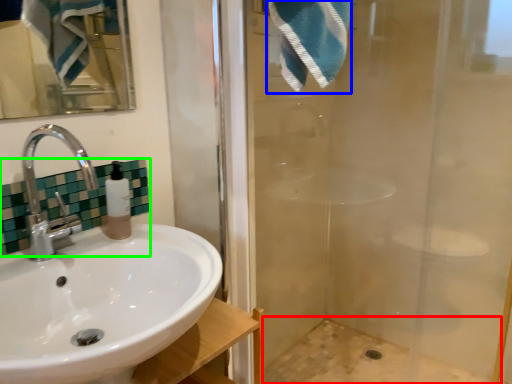
Question: Which is farther away from bath (highlighted by a red box)? bath towel (highlighted by a blue box) or tile (highlighted by a green box)?

Choices:
 (A) bath towel
 (B) tile

Answer: (A)